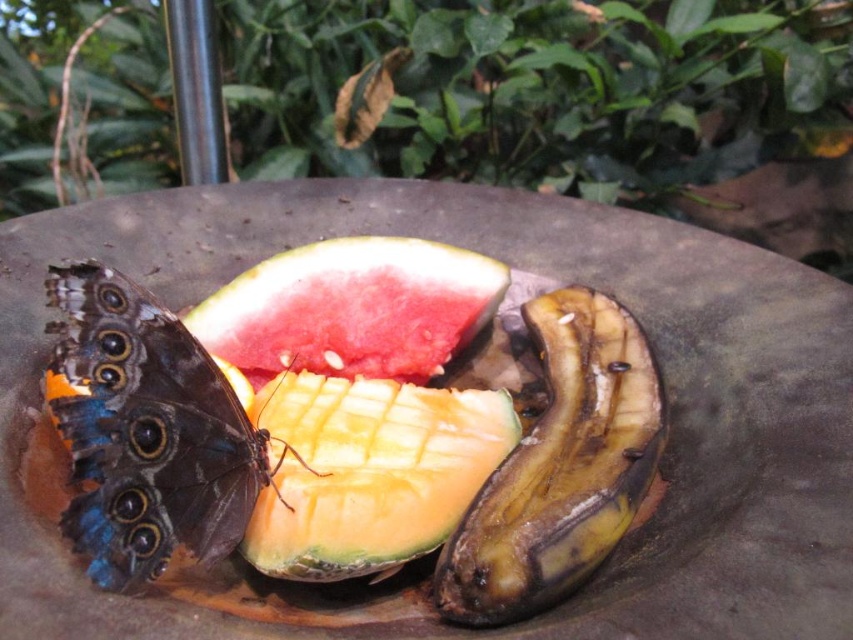
Which is more to the right, yellow-green fleshed melon at center or watermelon at center?

yellow-green fleshed melon at center

Does yellow-green fleshed melon at center lie behind watermelon at center?

No, it is not.

Describe the element at coordinates (366, 470) in the screenshot. I see `yellow-green fleshed melon at center` at that location.

Identify the location of yellow-green fleshed melon at center. This screenshot has width=853, height=640. (366, 470).

Which is behind, point (91, 419) or point (310, 292)?

Point (310, 292)

Between blue iridescent wings at lower left and watermelon at center, which one has less height?

watermelon at center is shorter.

What are the coordinates of `blue iridescent wings at lower left` in the screenshot? It's located at (146, 432).

Where is `blue iridescent wings at lower left`? blue iridescent wings at lower left is located at coordinates (146, 432).

Does point (573, 522) come closer to viewer compared to point (460, 307)?

Yes, point (573, 522) is in front of point (460, 307).

Can you confirm if ripe yellowish-brown banana at center is positioned to the left of watermelon at center?

No, ripe yellowish-brown banana at center is not to the left of watermelon at center.

Between point (567, 300) and point (440, 337), which one is positioned behind?

Positioned behind is point (440, 337).

This screenshot has height=640, width=853. I want to click on ripe yellowish-brown banana at center, so click(560, 467).